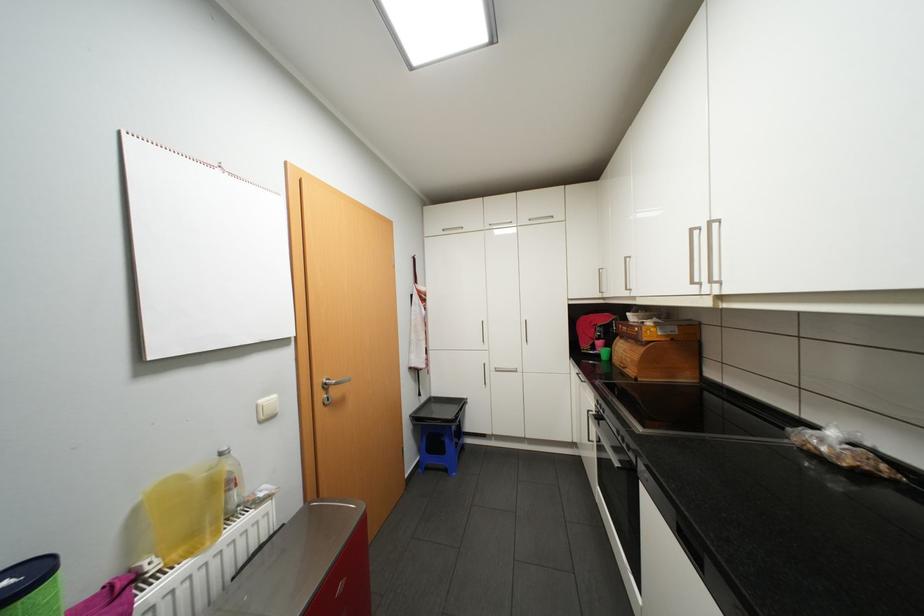
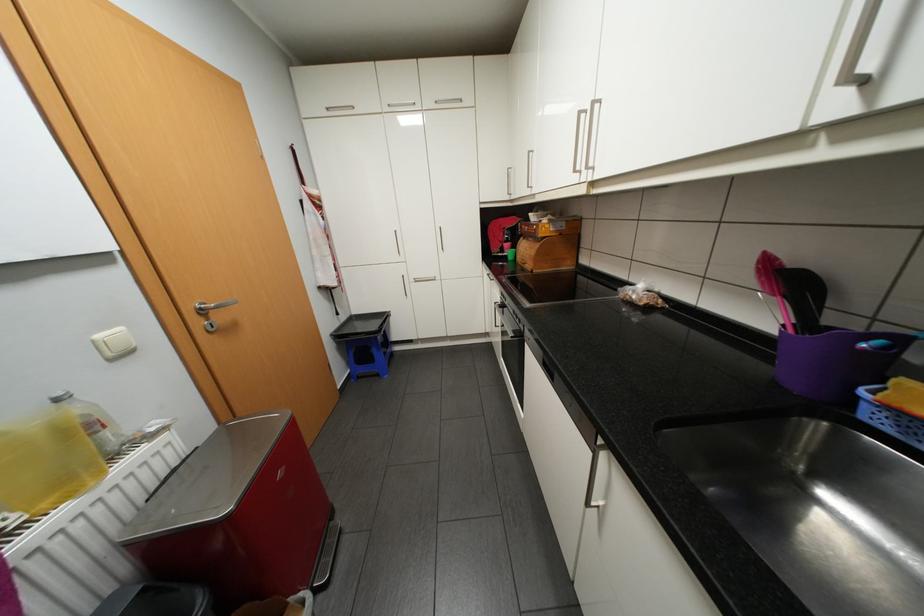
Question: In a continuous first-person perspective shot, in which direction is the camera moving?

Choices:
 (A) Left
 (B) Right
 (C) Forward
 (D) Backward

Answer: (B)